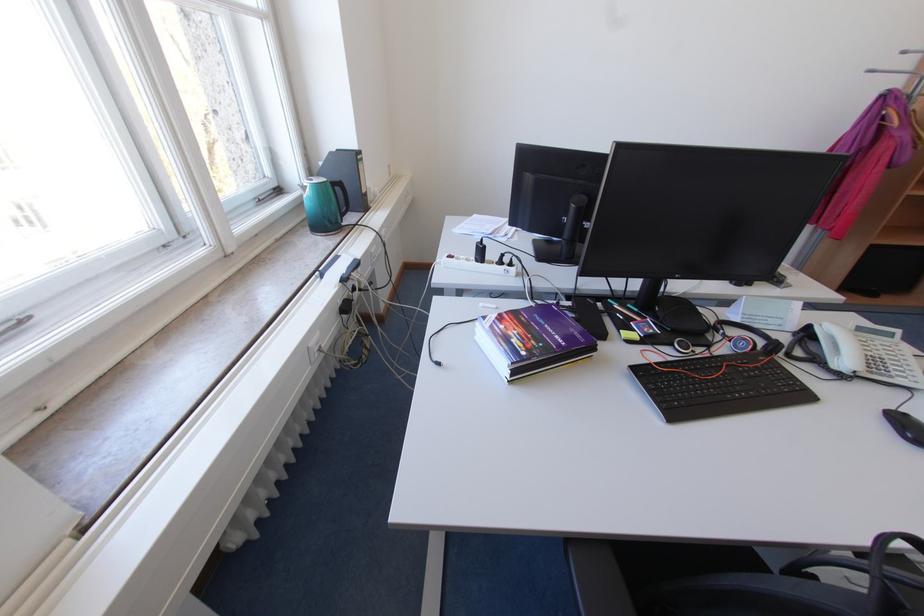
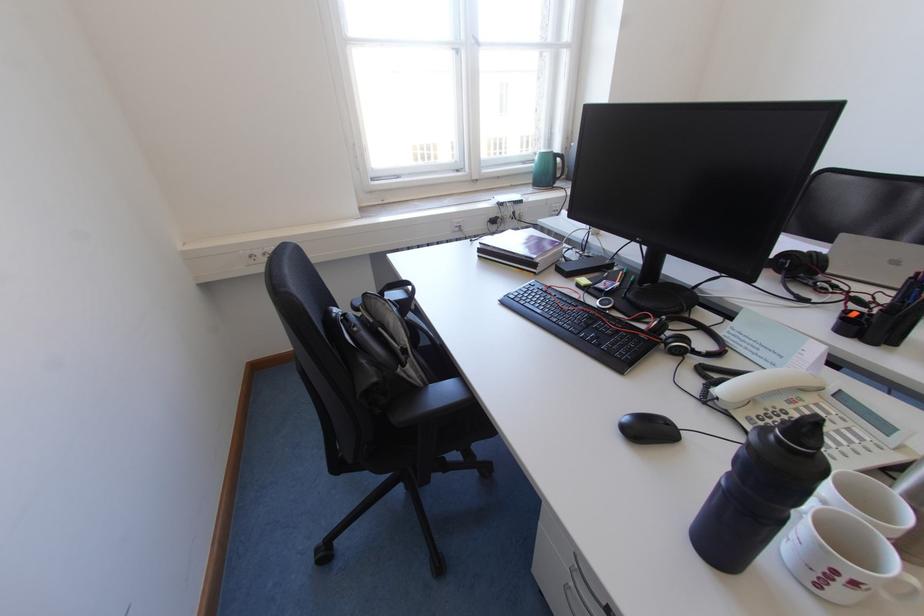
In the second image, find the point that corresponds to [517,383] in the first image.

(487, 257)